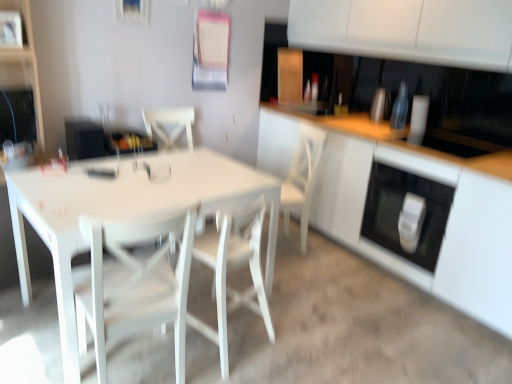
Question: Considering the relative sizes of white wood chair at center, acting as the 2th chair starting from the left, and white glossy table at center in the image provided, is white wood chair at center, acting as the 2th chair starting from the left, wider than white glossy table at center?

Choices:
 (A) no
 (B) yes

Answer: (A)

Question: Considering the relative sizes of white wood chair at center, the 1th chair from the right, and white glossy table at center in the image provided, is white wood chair at center, the 1th chair from the right, taller than white glossy table at center?

Choices:
 (A) no
 (B) yes

Answer: (B)

Question: Is white wood chair at center, the 1th chair from the right, facing away from white glossy table at center?

Choices:
 (A) yes
 (B) no

Answer: (B)

Question: From the image's perspective, is white wood chair at center, acting as the 2th chair starting from the left, under white glossy table at center?

Choices:
 (A) yes
 (B) no

Answer: (A)

Question: Are white wood chair at center, acting as the 2th chair starting from the left, and white glossy table at center beside each other?

Choices:
 (A) yes
 (B) no

Answer: (B)

Question: Is white glossy table at center surrounded by white wood chair at center, acting as the 2th chair starting from the left?

Choices:
 (A) yes
 (B) no

Answer: (B)

Question: Considering the relative sizes of white glossy table at center and white glossy cabinet at center in the image provided, is white glossy table at center wider than white glossy cabinet at center?

Choices:
 (A) no
 (B) yes

Answer: (B)

Question: From a real-world perspective, is white glossy table at center positioned over white glossy cabinet at center based on gravity?

Choices:
 (A) yes
 (B) no

Answer: (B)

Question: Does white glossy table at center have a smaller size compared to white glossy cabinet at center?

Choices:
 (A) yes
 (B) no

Answer: (A)

Question: From a real-world perspective, is white glossy table at center located beneath white glossy cabinet at center?

Choices:
 (A) no
 (B) yes

Answer: (B)

Question: Is white glossy table at center behind white glossy cabinet at center?

Choices:
 (A) yes
 (B) no

Answer: (B)

Question: Is the surface of white glossy table at center in direct contact with white glossy cabinet at center?

Choices:
 (A) yes
 (B) no

Answer: (B)

Question: Can you confirm if white wood chair at center, acting as the 2th chair starting from the left, is shorter than white wood chair at center?

Choices:
 (A) no
 (B) yes

Answer: (B)